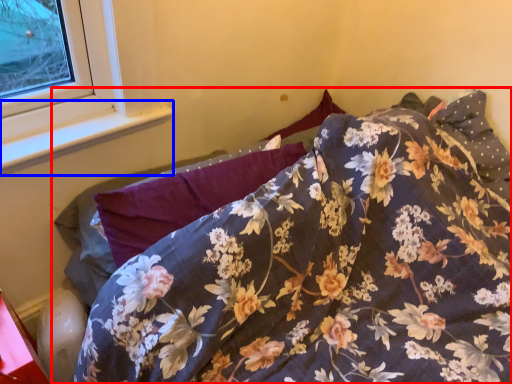
Question: Among these objects, which one is farthest to the camera, bed (highlighted by a red box) or window sill (highlighted by a blue box)?

Choices:
 (A) bed
 (B) window sill

Answer: (B)